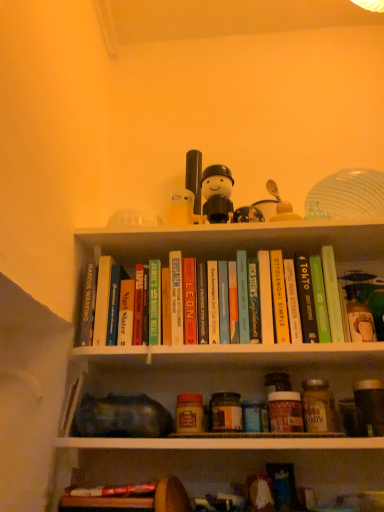
Question: Can you confirm if hardcover book at upper center, the 4th paperback book in the right-to-left sequence, is smaller than hardcover book at upper center, the third paperback book when ordered from right to left?

Choices:
 (A) no
 (B) yes

Answer: (B)

Question: Can you confirm if hardcover book at upper center, the 4th paperback book in the right-to-left sequence, is bigger than hardcover book at upper center, which ranks as the eighth paperback book in left-to-right order?

Choices:
 (A) yes
 (B) no

Answer: (B)

Question: Is hardcover book at upper center, the 4th paperback book in the right-to-left sequence, positioned far away from hardcover book at upper center, the third paperback book when ordered from right to left?

Choices:
 (A) yes
 (B) no

Answer: (B)

Question: Does hardcover book at upper center, the 4th paperback book in the right-to-left sequence, have a lesser width compared to hardcover book at upper center, the third paperback book when ordered from right to left?

Choices:
 (A) no
 (B) yes

Answer: (B)

Question: Is hardcover book at upper center, the 4th paperback book in the right-to-left sequence, further to the viewer compared to hardcover book at upper center, which ranks as the eighth paperback book in left-to-right order?

Choices:
 (A) no
 (B) yes

Answer: (B)

Question: Is hardcover book at upper center, the third paperback book when ordered from right to left, taller or shorter than hardcover book at upper center, positioned as the 7th paperback book in left-to-right order?

Choices:
 (A) tall
 (B) short

Answer: (A)

Question: Based on their sizes in the image, would you say hardcover book at upper center, the third paperback book when ordered from right to left, is bigger or smaller than hardcover book at upper center, the 4th paperback book in the right-to-left sequence?

Choices:
 (A) small
 (B) big

Answer: (B)

Question: From the image's perspective, is hardcover book at upper center, the third paperback book when ordered from right to left, above or below hardcover book at upper center, the 4th paperback book in the right-to-left sequence?

Choices:
 (A) above
 (B) below

Answer: (B)

Question: From a real-world perspective, is hardcover book at upper center, which ranks as the eighth paperback book in left-to-right order, physically located above or below hardcover book at upper center, the 4th paperback book in the right-to-left sequence?

Choices:
 (A) above
 (B) below

Answer: (A)

Question: Is hardcover book at center, which is the third paperback book in left-to-right order, wider or thinner than teal matte book at center, positioned as the seventh paperback book in right-to-left order?

Choices:
 (A) thin
 (B) wide

Answer: (A)

Question: Is hardcover book at center, which is the third paperback book in left-to-right order, situated inside teal matte book at center, positioned as the seventh paperback book in right-to-left order, or outside?

Choices:
 (A) inside
 (B) outside

Answer: (B)

Question: Considering their positions, is hardcover book at center, arranged as the 8th paperback book when viewed from the right, located in front of or behind teal matte book at center, which is the fourth paperback book in left-to-right order?

Choices:
 (A) behind
 (B) front

Answer: (A)

Question: In the image, is hardcover book at center, which is the third paperback book in left-to-right order, on the left side or the right side of teal matte book at center, positioned as the seventh paperback book in right-to-left order?

Choices:
 (A) left
 (B) right

Answer: (A)

Question: Is hardcover book at center, arranged as the fifth paperback book when viewed from the right, spatially inside teal matte book at center, positioned as the seventh paperback book in right-to-left order, or outside of it?

Choices:
 (A) inside
 (B) outside

Answer: (B)

Question: Is hardcover book at center, which is the 6th paperback book from left to right, wider or thinner than teal matte book at center, positioned as the seventh paperback book in right-to-left order?

Choices:
 (A) thin
 (B) wide

Answer: (A)